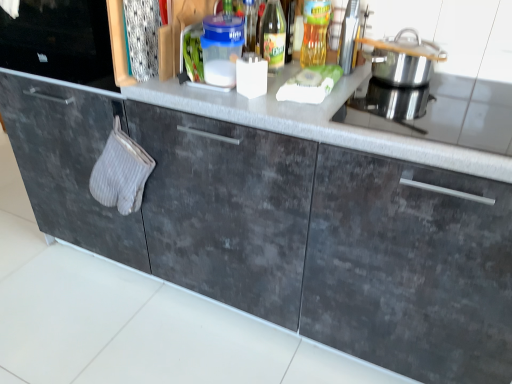
This screenshot has width=512, height=384. Identify the location of free space in front of silver metallic pot at upper right. (394, 107).